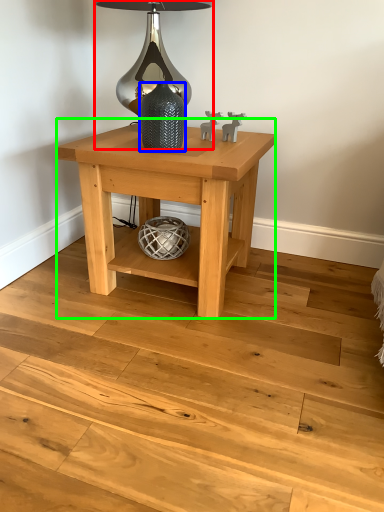
Question: Which object is the farthest from table lamp (highlighted by a red box)? Choose among these: glass vase (highlighted by a blue box) or table (highlighted by a green box).

Choices:
 (A) glass vase
 (B) table

Answer: (B)